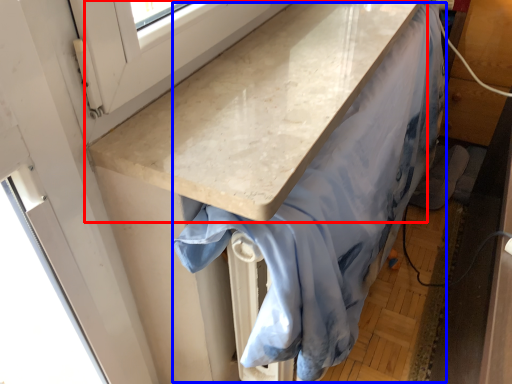
Question: Which point is closer to the camera, countertop (highlighted by a red box) or fabric (highlighted by a blue box)?

Choices:
 (A) countertop
 (B) fabric

Answer: (A)